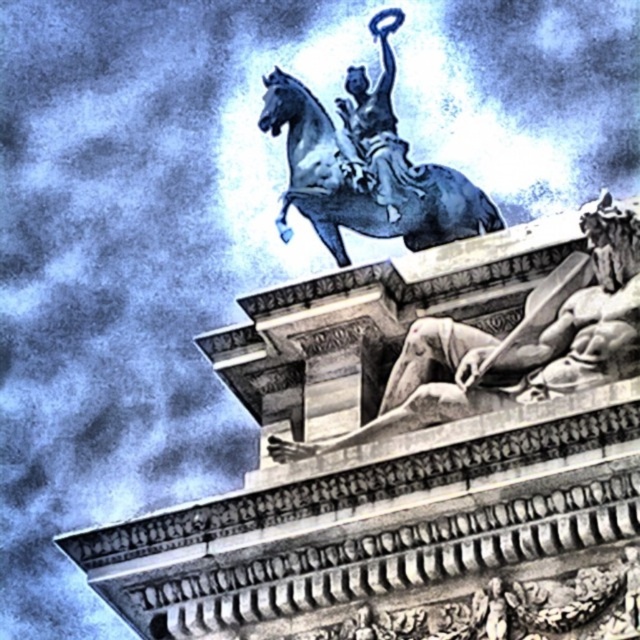
Question: Does smooth stone reclining figure at center appear on the left side of shiny blue horse at center?

Choices:
 (A) no
 (B) yes

Answer: (A)

Question: Among these points, which one is farthest from the camera?

Choices:
 (A) (326, 228)
 (B) (269, 452)

Answer: (A)

Question: Which point is farther from the camera taking this photo?

Choices:
 (A) (428, 326)
 (B) (324, 140)

Answer: (B)

Question: Is smooth stone reclining figure at center further to camera compared to shiny blue horse at center?

Choices:
 (A) no
 (B) yes

Answer: (A)

Question: Does smooth stone reclining figure at center appear over shiny blue horse at center?

Choices:
 (A) yes
 (B) no

Answer: (B)